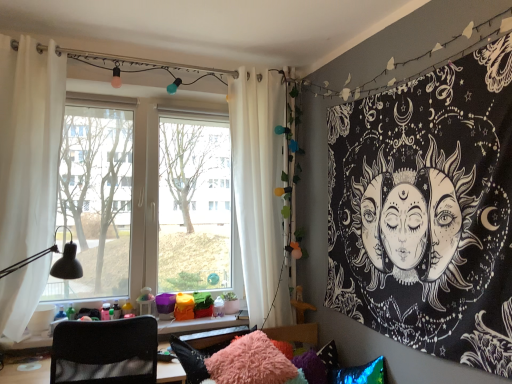
Question: Would you say black mesh chair at lower left is outside black paper tapestry at upper right?

Choices:
 (A) no
 (B) yes

Answer: (B)

Question: From a real-world perspective, does black mesh chair at lower left sit lower than black paper tapestry at upper right?

Choices:
 (A) no
 (B) yes

Answer: (B)

Question: Is black mesh chair at lower left taller than black paper tapestry at upper right?

Choices:
 (A) no
 (B) yes

Answer: (A)

Question: Is the depth of black mesh chair at lower left greater than that of black paper tapestry at upper right?

Choices:
 (A) no
 (B) yes

Answer: (B)

Question: Does black mesh chair at lower left have a smaller size compared to black paper tapestry at upper right?

Choices:
 (A) yes
 (B) no

Answer: (B)

Question: Which is correct: black paper tapestry at upper right is inside fuzzy pink pillow at lower center, or outside of it?

Choices:
 (A) outside
 (B) inside

Answer: (A)

Question: From a real-world perspective, relative to fuzzy pink pillow at lower center, is black paper tapestry at upper right vertically above or below?

Choices:
 (A) above
 (B) below

Answer: (A)

Question: In terms of width, does black paper tapestry at upper right look wider or thinner when compared to fuzzy pink pillow at lower center?

Choices:
 (A) thin
 (B) wide

Answer: (A)

Question: In the image, is black paper tapestry at upper right positioned in front of or behind fuzzy pink pillow at lower center?

Choices:
 (A) behind
 (B) front

Answer: (B)

Question: Considering the positions of white fabric curtain at right, arranged as the 2th curtain when viewed from the left, and fuzzy pink pillow at lower center in the image, is white fabric curtain at right, arranged as the 2th curtain when viewed from the left, bigger or smaller than fuzzy pink pillow at lower center?

Choices:
 (A) small
 (B) big

Answer: (B)

Question: From the image's perspective, is white fabric curtain at right, arranged as the 2th curtain when viewed from the left, positioned above or below fuzzy pink pillow at lower center?

Choices:
 (A) above
 (B) below

Answer: (A)

Question: Does point (261, 306) appear closer or farther from the camera than point (269, 355)?

Choices:
 (A) farther
 (B) closer

Answer: (A)

Question: Looking at their shapes, would you say white fabric curtain at right, which appears as the second curtain when viewed from the front, is wider or thinner than fuzzy pink pillow at lower center?

Choices:
 (A) wide
 (B) thin

Answer: (B)

Question: Is white fabric curtain at right, arranged as the 2th curtain when viewed from the left, wider or thinner than black paper tapestry at upper right?

Choices:
 (A) wide
 (B) thin

Answer: (A)

Question: From the image's perspective, is white fabric curtain at right, which appears as the second curtain when viewed from the front, positioned above or below black paper tapestry at upper right?

Choices:
 (A) above
 (B) below

Answer: (A)